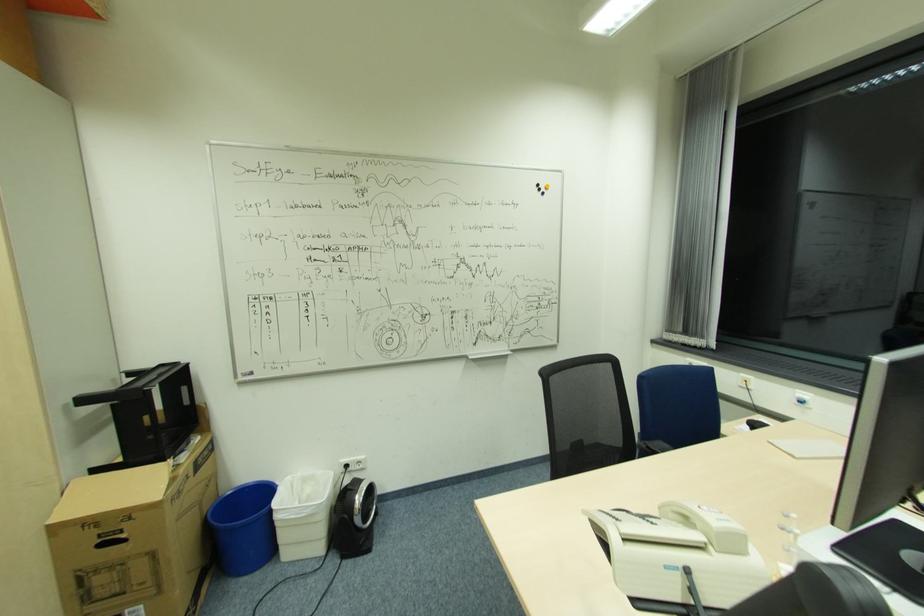
Which object does [888,554] point to?

This point indicates the black monitor stand.